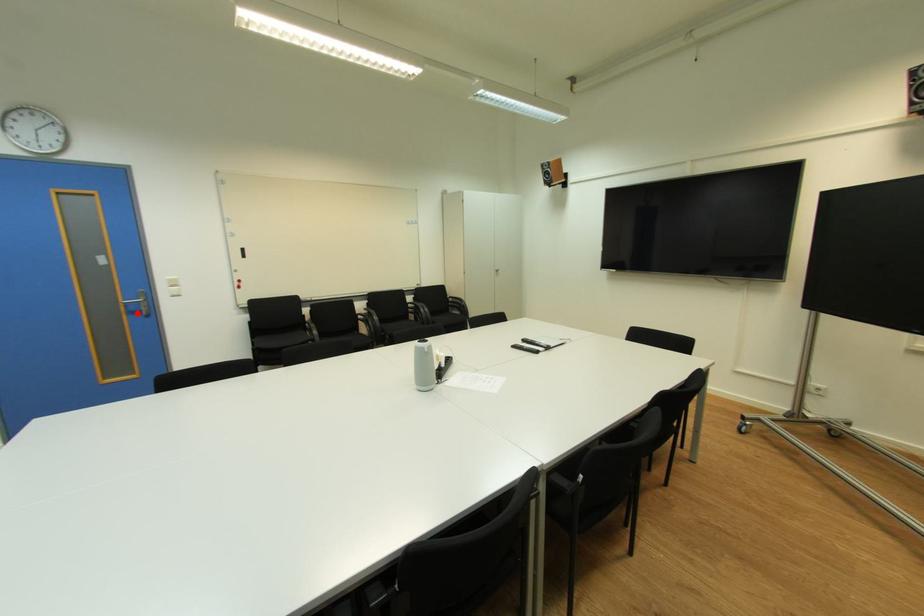
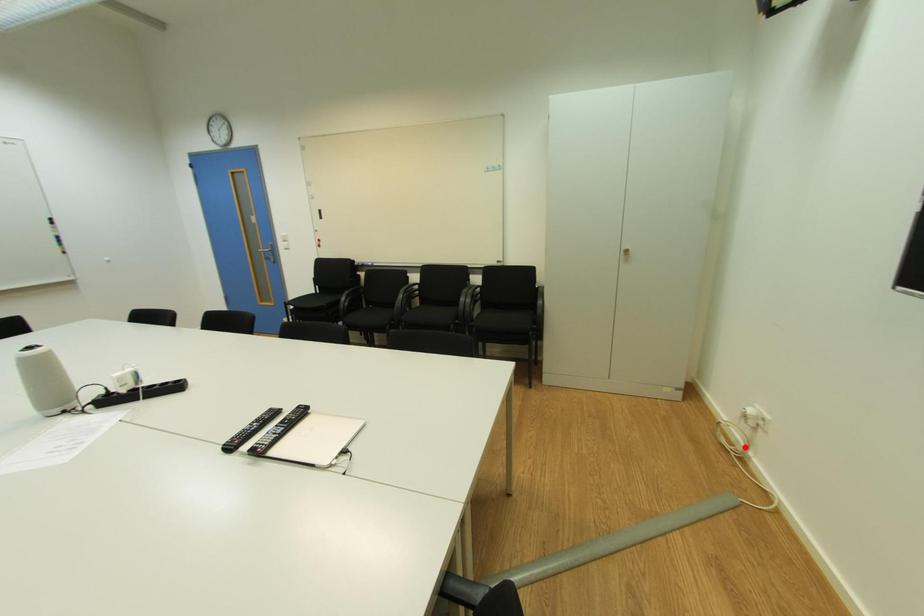
I am providing you with two images of the same scene from different viewpoints. A red point is marked on the first image and another point is marked on the second image. Do the highlighted points in image1 and image2 indicate the same real-world spot?

No